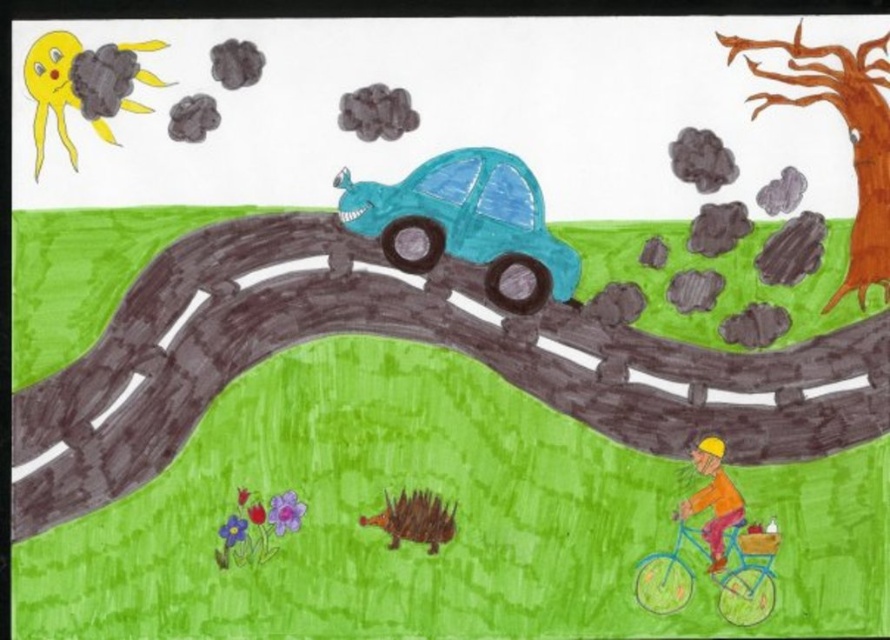
You are standing at the point marked by the coordinates point (466, 211) in the image. What object are you directly at?

The point (466, 211) marks the teal matte car at center.

You are a pedestrian standing on the road in the image. You see the teal matte car at center and the brown rough bark tree at upper right. Which object is closer to you?

The teal matte car at center is closer to you because the brown rough bark tree at upper right is behind it.

You are a child looking at this drawing and want to know which object is bigger between the teal matte car at center and the brown rough bark tree at upper right. Can you tell me?

The teal matte car at center is smaller than the brown rough bark tree at upper right, so the brown rough bark tree at upper right is bigger.